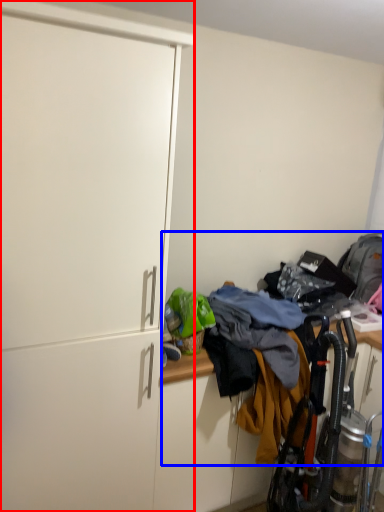
Question: Which of the following is the farthest to the observer, cabinetry (highlighted by a red box) or laundry (highlighted by a blue box)?

Choices:
 (A) cabinetry
 (B) laundry

Answer: (B)